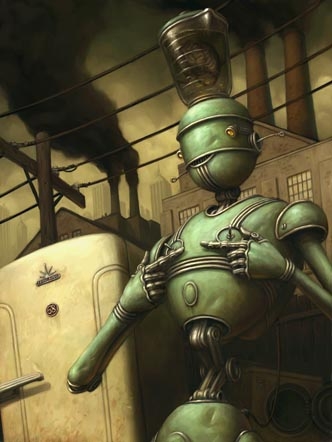
The height and width of the screenshot is (442, 332). Find the location of `open door`. open door is located at coordinates (320, 405).